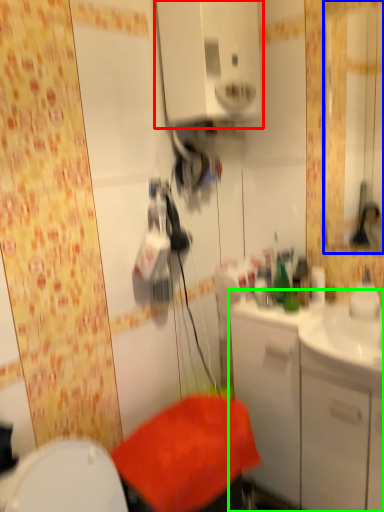
Question: Estimate the real-world distances between objects in this image. Which object is farther from medicine cabinet (highlighted by a red box), mirror (highlighted by a blue box) or bathroom cabinet (highlighted by a green box)?

Choices:
 (A) mirror
 (B) bathroom cabinet

Answer: (A)